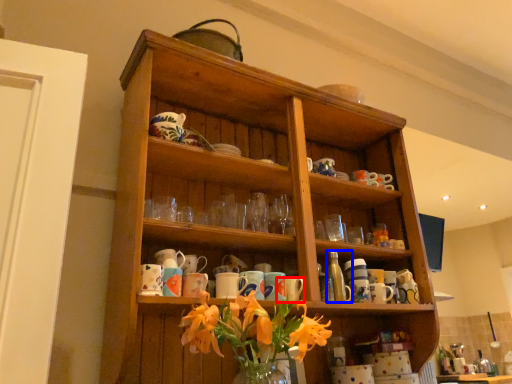
Question: Which of the following is the farthest to the observer, mug (highlighted by a red box) or bottle (highlighted by a blue box)?

Choices:
 (A) mug
 (B) bottle

Answer: (B)